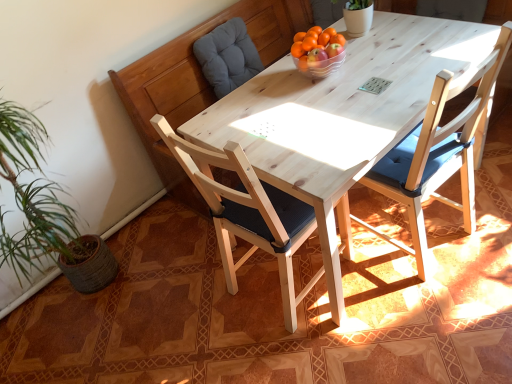
Question: Considering the relative positions of light wood chair at center, the 2th chair viewed from the left, and gray fabric cushion at upper left in the image provided, is light wood chair at center, the 2th chair viewed from the left, behind gray fabric cushion at upper left?

Choices:
 (A) no
 (B) yes

Answer: (A)

Question: Can you confirm if light wood chair at center, the 2th chair viewed from the left, is taller than gray fabric cushion at upper left?

Choices:
 (A) yes
 (B) no

Answer: (A)

Question: Can you confirm if light wood chair at center, the 2th chair viewed from the left, is bigger than gray fabric cushion at upper left?

Choices:
 (A) yes
 (B) no

Answer: (A)

Question: Does light wood chair at center, the 2th chair viewed from the left, have a lesser height compared to gray fabric cushion at upper left?

Choices:
 (A) yes
 (B) no

Answer: (B)

Question: Considering the relative positions of light wood chair at center, which is the first chair in right-to-left order, and gray fabric cushion at upper left in the image provided, is light wood chair at center, which is the first chair in right-to-left order, to the right of gray fabric cushion at upper left from the viewer's perspective?

Choices:
 (A) yes
 (B) no

Answer: (A)

Question: Considering the relative positions of translucent glass bowl at center and light wood chair at center, which is the first chair in right-to-left order, in the image provided, is translucent glass bowl at center to the left or to the right of light wood chair at center, which is the first chair in right-to-left order,?

Choices:
 (A) right
 (B) left

Answer: (B)

Question: Is translucent glass bowl at center inside the boundaries of light wood chair at center, which is the first chair in right-to-left order, or outside?

Choices:
 (A) inside
 (B) outside

Answer: (B)

Question: From the image's perspective, is translucent glass bowl at center above or below light wood chair at center, the 2th chair viewed from the left?

Choices:
 (A) below
 (B) above

Answer: (B)

Question: In terms of height, does translucent glass bowl at center look taller or shorter compared to light wood chair at center, the 2th chair viewed from the left?

Choices:
 (A) short
 (B) tall

Answer: (A)

Question: Does point (285, 210) appear closer or farther from the camera than point (387, 175)?

Choices:
 (A) closer
 (B) farther

Answer: (A)

Question: Considering their positions, is natural wood chair at center, which is the second chair in right-to-left order, located in front of or behind light wood chair at center, the 2th chair viewed from the left?

Choices:
 (A) behind
 (B) front

Answer: (B)

Question: Based on their positions, is natural wood chair at center, which is the 1th chair from left to right, located to the left or right of light wood chair at center, the 2th chair viewed from the left?

Choices:
 (A) left
 (B) right

Answer: (A)

Question: Is natural wood chair at center, which is the second chair in right-to-left order, situated inside light wood chair at center, which is the first chair in right-to-left order, or outside?

Choices:
 (A) outside
 (B) inside

Answer: (A)

Question: Is gray fabric cushion at upper left inside or outside of translucent glass bowl at center?

Choices:
 (A) outside
 (B) inside

Answer: (A)

Question: Looking at the image, does gray fabric cushion at upper left seem bigger or smaller compared to translucent glass bowl at center?

Choices:
 (A) big
 (B) small

Answer: (A)